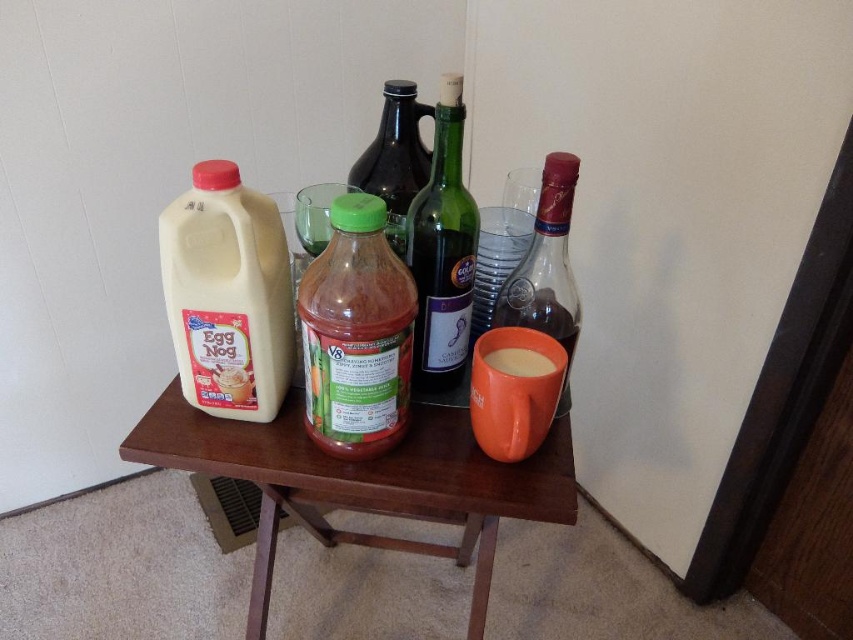
Question: Which object appears closest to the camera in this image?

Choices:
 (A) translucent glass bottle at right
 (B) white matte egg nog at left

Answer: (A)

Question: Is white matte jug at left above green glass bottle at center?

Choices:
 (A) no
 (B) yes

Answer: (A)

Question: Does wooden table at center have a larger size compared to white matte egg nog at left?

Choices:
 (A) yes
 (B) no

Answer: (A)

Question: Does green matte plastic bottle at center have a larger size compared to white matte egg nog at left?

Choices:
 (A) yes
 (B) no

Answer: (A)

Question: Based on their relative distances, which object is nearer to the white matte egg nog at left?

Choices:
 (A) white matte jug at left
 (B) wooden table at center
 (C) green matte bottle at center

Answer: (A)

Question: Which object appears farthest from the camera in this image?

Choices:
 (A) green matte plastic bottle at center
 (B) green glass bottle at center
 (C) green matte bottle at center
 (D) white matte egg nog at left

Answer: (D)